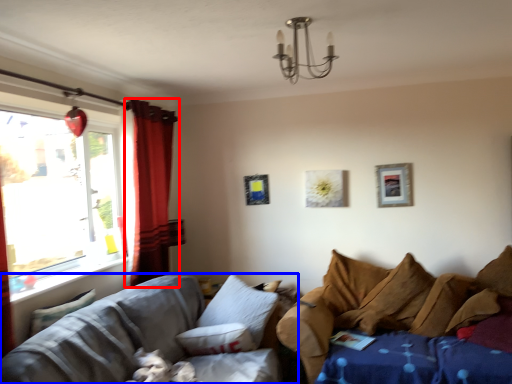
Question: Which of the following is the closest to the observer, curtain (highlighted by a red box) or studio couch (highlighted by a blue box)?

Choices:
 (A) curtain
 (B) studio couch

Answer: (B)